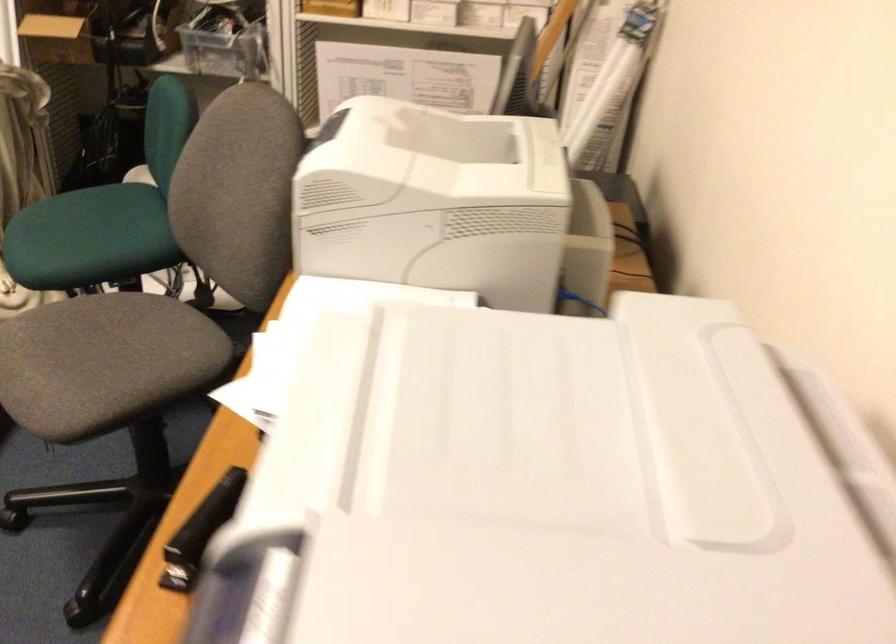
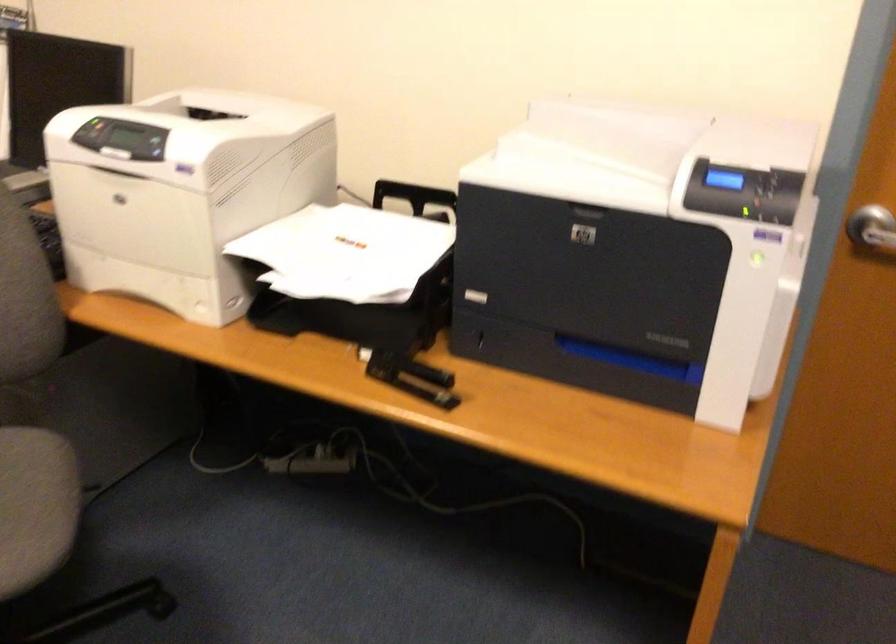
Where in the second image is the point corresponding to (x=99, y=388) from the first image?

(35, 506)